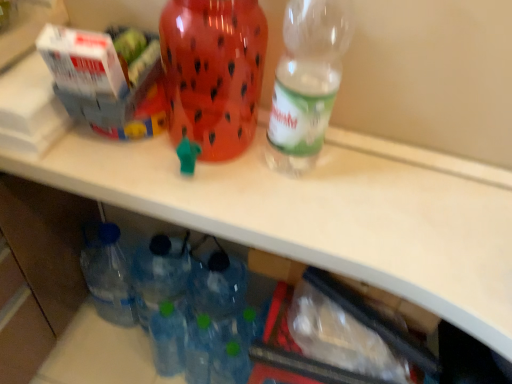
Question: Choose the correct answer: Is white cardboard box at upper left, which is the first box from right to left, inside clear plastic bottle at upper right, which is counted as the 2th bottle, starting from the left, or outside it?

Choices:
 (A) outside
 (B) inside

Answer: (A)

Question: Is white cardboard box at upper left, which is the first box from right to left, wider or thinner than clear plastic bottle at upper right, which is counted as the 2th bottle, starting from the left?

Choices:
 (A) thin
 (B) wide

Answer: (B)

Question: Estimate the real-world distances between objects in this image. Which object is farther from the clear plastic bottle at upper right, positioned as the 1th bottle in right-to-left order?

Choices:
 (A) white cardboard box at upper left, the first box from the left
 (B) white cardboard box at upper left, which appears as the second box when viewed from the left
 (C) translucent plastic water jug at center, which is counted as the 1th bottle, starting from the left

Answer: (A)

Question: Based on their relative distances, which object is farther from the white cardboard box at upper left, the first box from the left?

Choices:
 (A) translucent plastic water jug at center, which is counted as the 1th bottle, starting from the left
 (B) clear plastic bottle at upper right, positioned as the 1th bottle in right-to-left order
 (C) white cardboard box at upper left, which is the first box from right to left

Answer: (B)